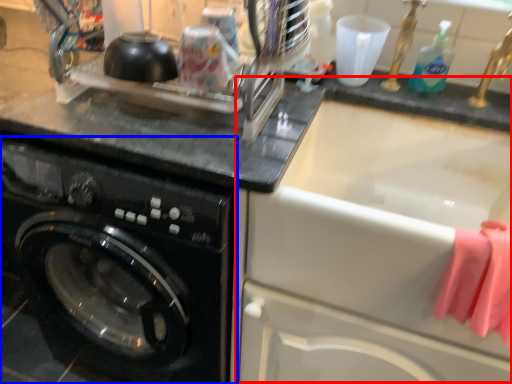
Question: Among these objects, which one is nearest to the camera, sink (highlighted by a red box) or washing machine (highlighted by a blue box)?

Choices:
 (A) sink
 (B) washing machine

Answer: (A)